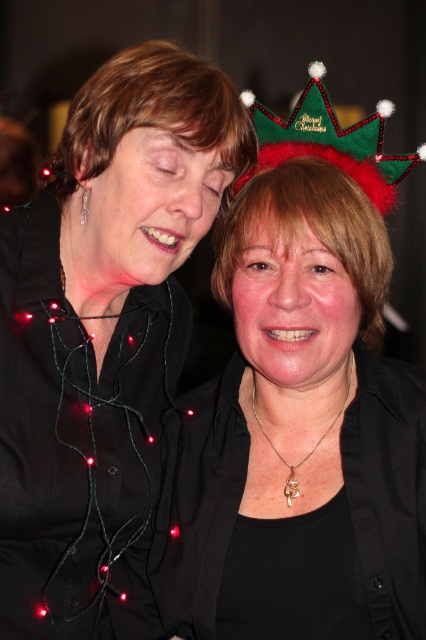
Question: Does matte black shirt at upper left appear under matte black hair at upper left?

Choices:
 (A) no
 (B) yes

Answer: (B)

Question: Considering the real-world distances, which object is closest to the black matte/black textured hair at center?

Choices:
 (A) matte black hair at center
 (B) green fuzzy crown at upper right
 (C) matte black hair at upper left

Answer: (A)

Question: Is matte black hair at center behind green fuzzy crown at upper right?

Choices:
 (A) no
 (B) yes

Answer: (A)

Question: Can you confirm if matte black hair at center is bigger than green fuzzy crown at upper right?

Choices:
 (A) no
 (B) yes

Answer: (A)

Question: Which point is farther to the camera?

Choices:
 (A) matte black hair at upper left
 (B) matte black hair at center
 (C) green fuzzy crown at upper right

Answer: (C)

Question: Which point is farther to the camera?

Choices:
 (A) (296, 224)
 (B) (68, 193)
 (C) (224, 116)

Answer: (B)